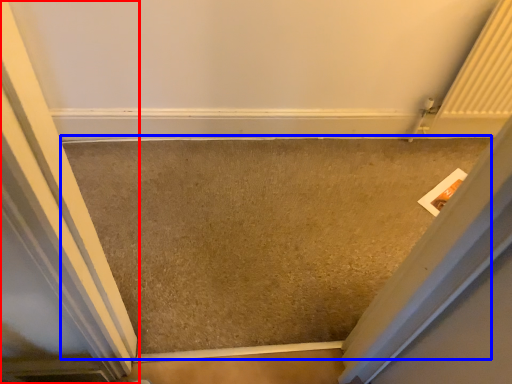
Question: Which object is closer to the camera taking this photo, door (highlighted by a red box) or concrete (highlighted by a blue box)?

Choices:
 (A) door
 (B) concrete

Answer: (A)